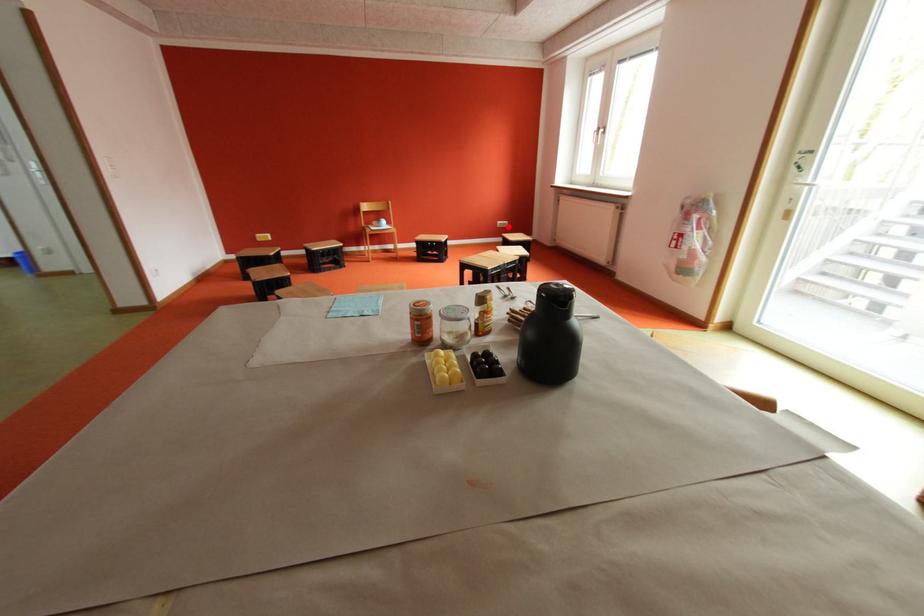
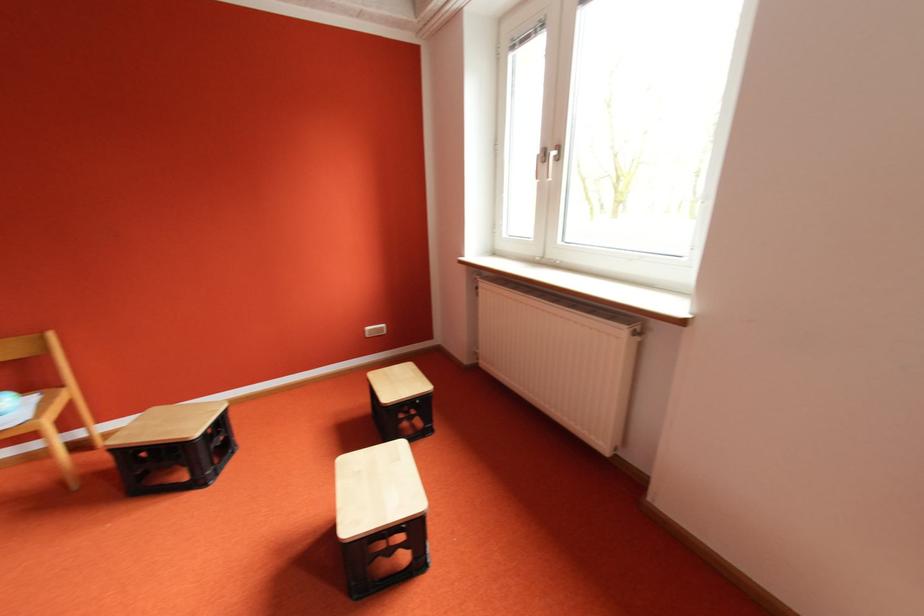
Question: I am providing you with two images of the same scene from different viewpoints. A red point is shown in image1. For the corresponding object point in image2, is it positioned nearer or farther from the camera?

Choices:
 (A) Nearer
 (B) Farther

Answer: (B)